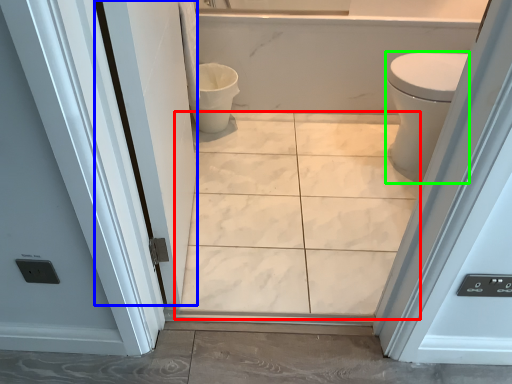
Question: Which object is the closest to the ceramic tile (highlighted by a red box)? Choose among these: screen door (highlighted by a blue box) or bidet (highlighted by a green box).

Choices:
 (A) screen door
 (B) bidet

Answer: (A)